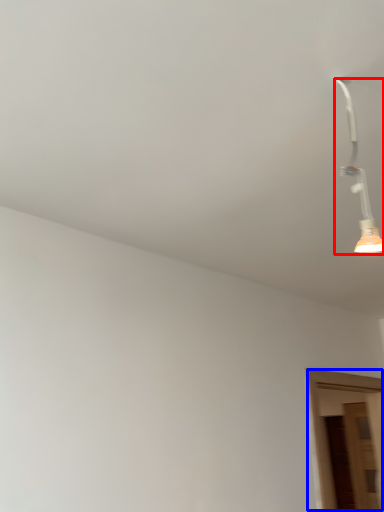
Question: Which of the following is the closest to the observer, lamp (highlighted by a red box) or door (highlighted by a blue box)?

Choices:
 (A) lamp
 (B) door

Answer: (A)